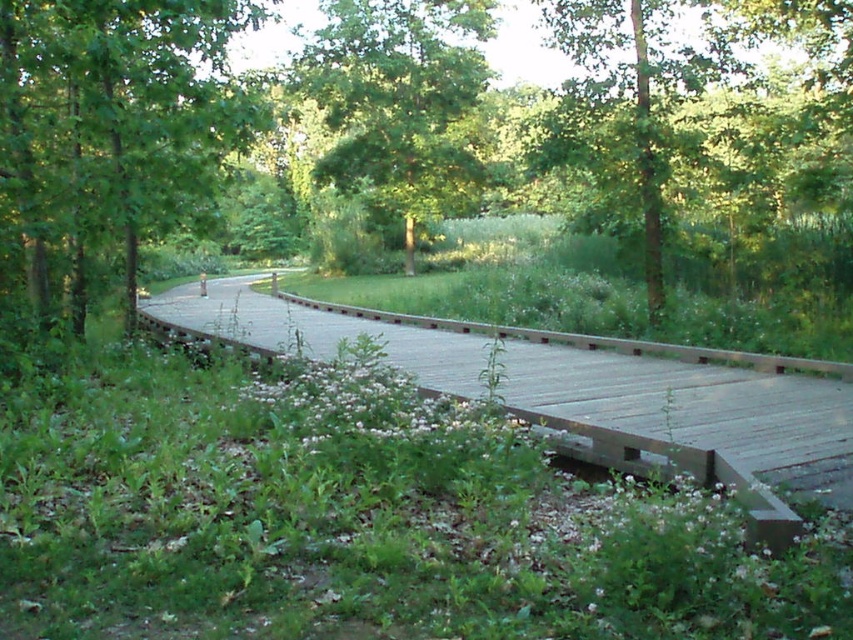
You are standing on the wooden boardwalk and want to cross to the other side. There is a wooden bridge at center located at point (x=589, y=392). Is the wooden bridge at center the only structure available for crossing?

The wooden bridge at center is located at point (x=589, y=392), so yes, it is the only structure available for crossing as there are no other bridges or paths mentioned in the scene description.

You are standing at the center of the wooden boardwalk in the image. Looking towards the left side of the boardwalk, can you see a green matte tree at point (108, 140)?

Yes, the green matte tree at left is located at point (108, 140), so it can be seen from the center of the boardwalk when looking towards the left side.